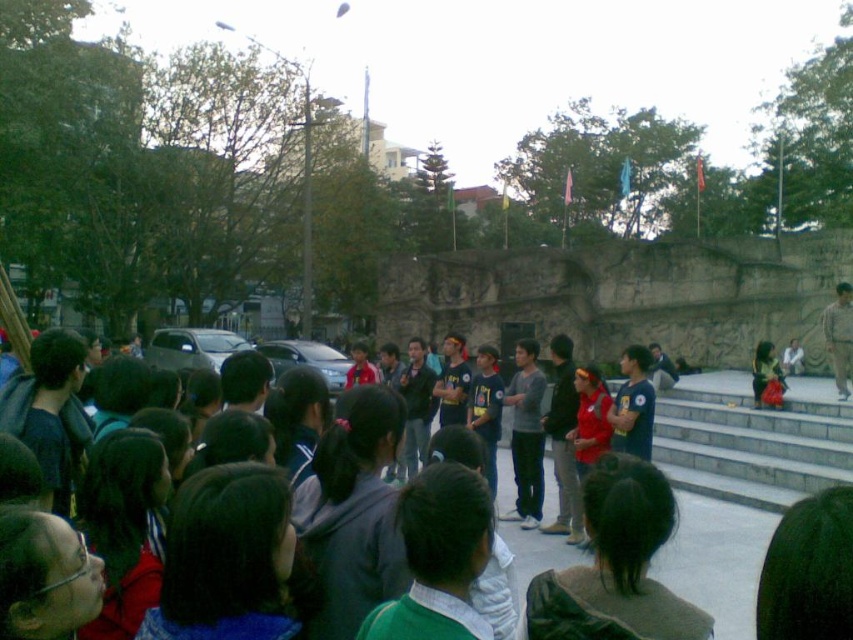
Question: Is dark blue shirt at center smaller than light brown fabric shirt at center?

Choices:
 (A) yes
 (B) no

Answer: (B)

Question: Which object is positioned farthest from the light brown fabric shirt at center?

Choices:
 (A) red fabric dress at center
 (B) dark brown hair at center

Answer: (B)

Question: Does gray concrete stairs at center have a smaller size compared to red fabric dress at center?

Choices:
 (A) no
 (B) yes

Answer: (A)

Question: Which object appears closest to the camera in this image?

Choices:
 (A) dark brown hair at center
 (B) dark blue shirt at center
 (C) blue denim jacket at center

Answer: (A)

Question: Can you confirm if dark blue shirt at center is wider than light brown fabric shirt at center?

Choices:
 (A) no
 (B) yes

Answer: (B)

Question: Which of the following is the closest to the observer?

Choices:
 (A) light brown fabric shirt at center
 (B) gray concrete stairs at center
 (C) dark brown hair at center

Answer: (C)